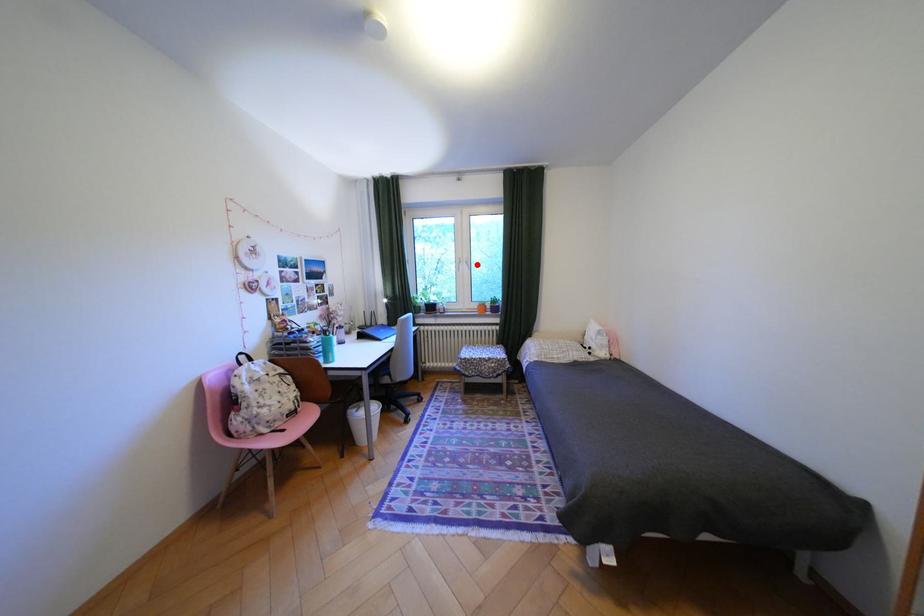
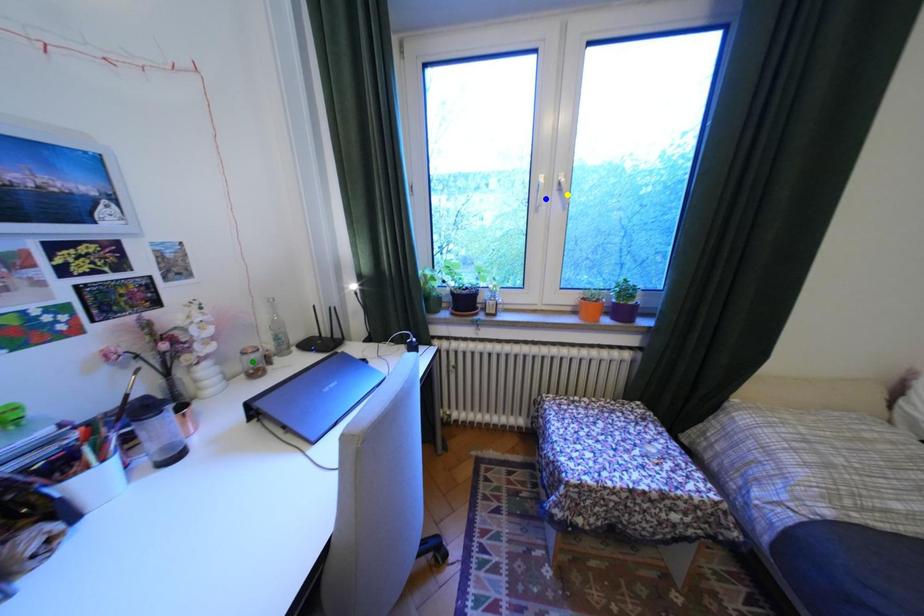
Question: I am providing you with two images of the same scene from different viewpoints. A red point is marked on the first image. You are given multiple points on the second image. Can you choose the point in image 2 that corresponds to the point in image 1?

Choices:
 (A) green point
 (B) yellow point
 (C) blue point

Answer: (B)